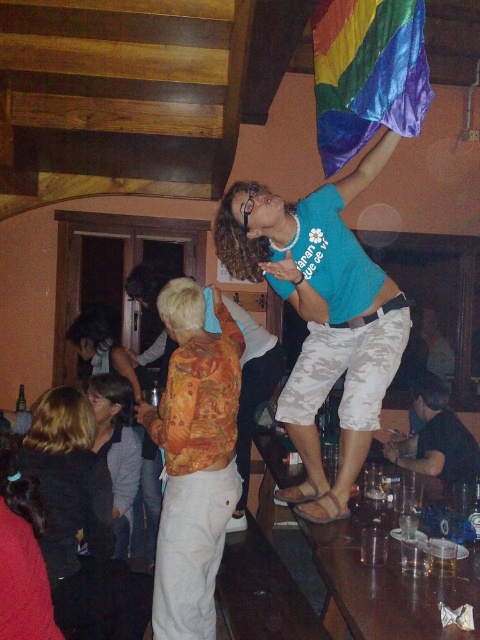
Question: Can you confirm if rainbow satin flag at upper right is bigger than black matte shirt at lower right?

Choices:
 (A) yes
 (B) no

Answer: (A)

Question: Does black leather jacket at lower left have a smaller size compared to matte gray shirt at lower left?

Choices:
 (A) yes
 (B) no

Answer: (A)

Question: Which object is positioned closest to the orange printed shirt at center?

Choices:
 (A) blue t-shirt at upper center
 (B) black matte shirt at lower right

Answer: (A)

Question: Which object is positioned farthest from the blue t-shirt at upper center?

Choices:
 (A) matte gray shirt at lower left
 (B) black leather jacket at lower left
 (C) orange printed shirt at center

Answer: (A)

Question: Which of the following is the farthest from the observer?

Choices:
 (A) orange floral shirt at lower left
 (B) rainbow satin flag at upper right
 (C) blue t-shirt at upper center
 (D) black matte shirt at lower right

Answer: (A)

Question: Does orange printed shirt at center have a larger size compared to black leather jacket at lower left?

Choices:
 (A) yes
 (B) no

Answer: (A)